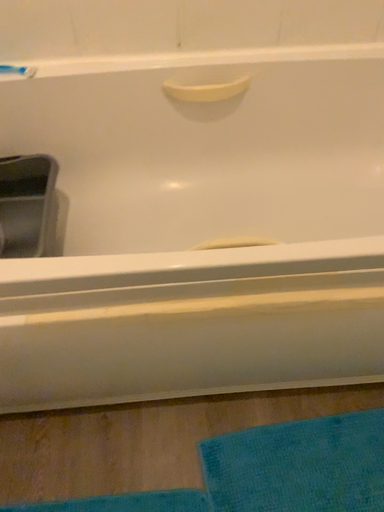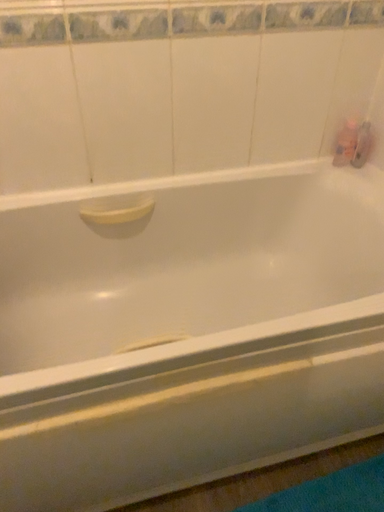
Question: Which way did the camera rotate in the video?

Choices:
 (A) rotated upward
 (B) rotated downward

Answer: (A)